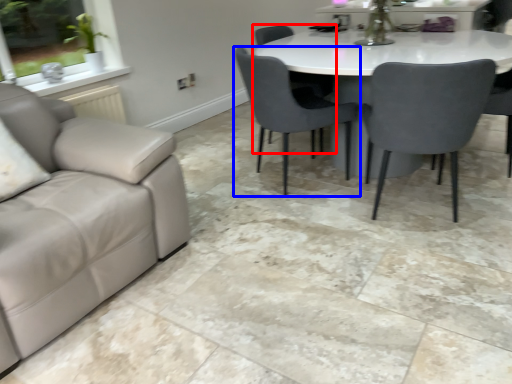
Question: Which object is closer to the camera taking this photo, chair (highlighted by a red box) or chair (highlighted by a blue box)?

Choices:
 (A) chair
 (B) chair

Answer: (B)